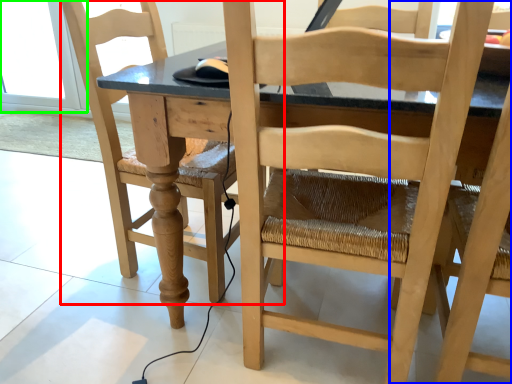
Question: Considering the real-world distances, which object is closest to chair (highlighted by a red box)? chair (highlighted by a blue box) or glass door (highlighted by a green box).

Choices:
 (A) chair
 (B) glass door

Answer: (A)